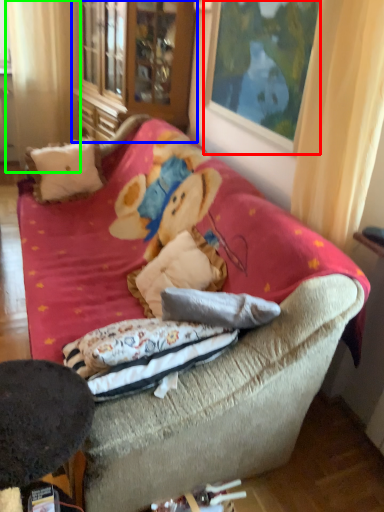
Question: Which object is the farthest from picture frame (highlighted by a red box)? Choose among these: armoire (highlighted by a blue box) or curtain (highlighted by a green box).

Choices:
 (A) armoire
 (B) curtain

Answer: (B)